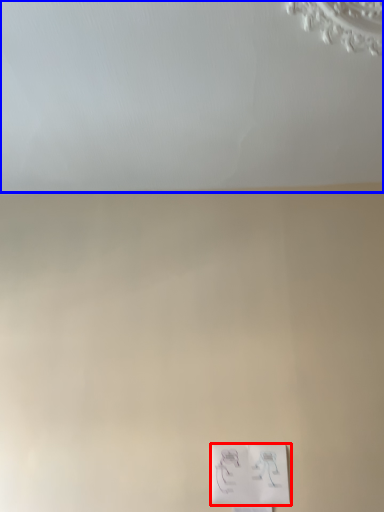
Question: Which object is closer to the camera taking this photo, light switch (highlighted by a red box) or backdrop (highlighted by a blue box)?

Choices:
 (A) light switch
 (B) backdrop

Answer: (B)